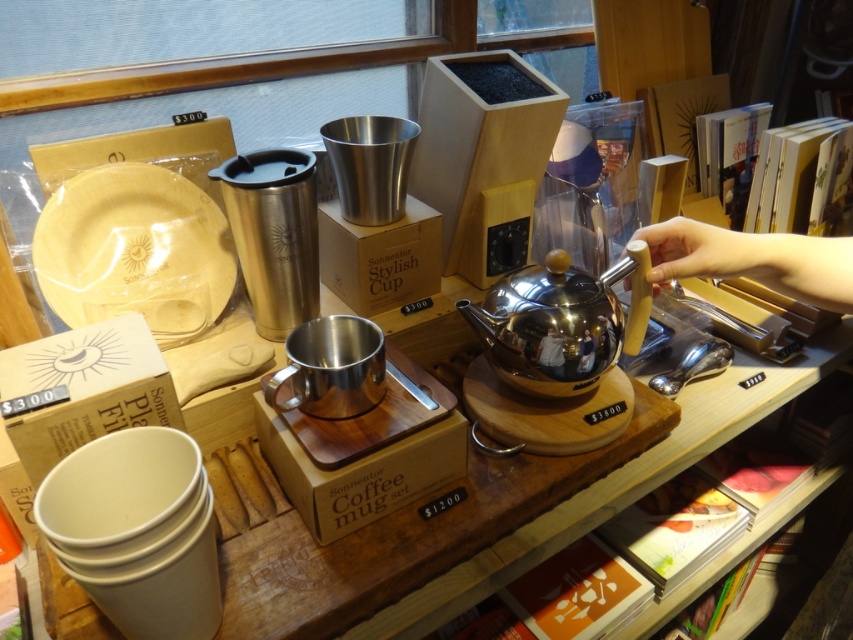
Does wooden spoon at upper right have a larger size compared to metallic cardboard box at center?

No.

Who is more distant from viewer, (775, 276) or (380, 236)?

Point (380, 236)

Is point (843, 253) farther from camera compared to point (436, 264)?

No, it is in front of (436, 264).

The image size is (853, 640). I want to click on wooden spoon at upper right, so click(753, 259).

Is point (48, 465) positioned in front of point (332, 289)?

Yes.

Measure the distance from matte white plate at lower left to metallic cardboard box at center.

14.66 inches

Is point (84, 385) farther from camera compared to point (403, 272)?

No, (84, 385) is closer to viewer.

I want to click on matte white plate at lower left, so click(x=77, y=397).

Which is below, natural wood plate at left or wooden spoon at upper right?

wooden spoon at upper right is below.

Between point (218, 275) and point (846, 256), which one is positioned in front?

Point (846, 256) is more forward.

You are a GUI agent. You are given a task and a screenshot of the screen. Output one action in this format:
    pyautogui.click(x=<x>, y=<y>)
    Task: Click on the natural wood plate at left
    The width and height of the screenshot is (853, 640).
    Given the screenshot: What is the action you would take?
    pyautogui.click(x=134, y=250)